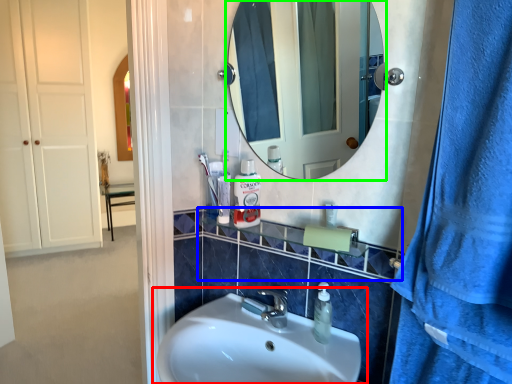
Question: Which object is positioned closest to sink (highlighted by a red box)? Select from balustrade (highlighted by a blue box) and mirror (highlighted by a green box).

Choices:
 (A) balustrade
 (B) mirror

Answer: (A)